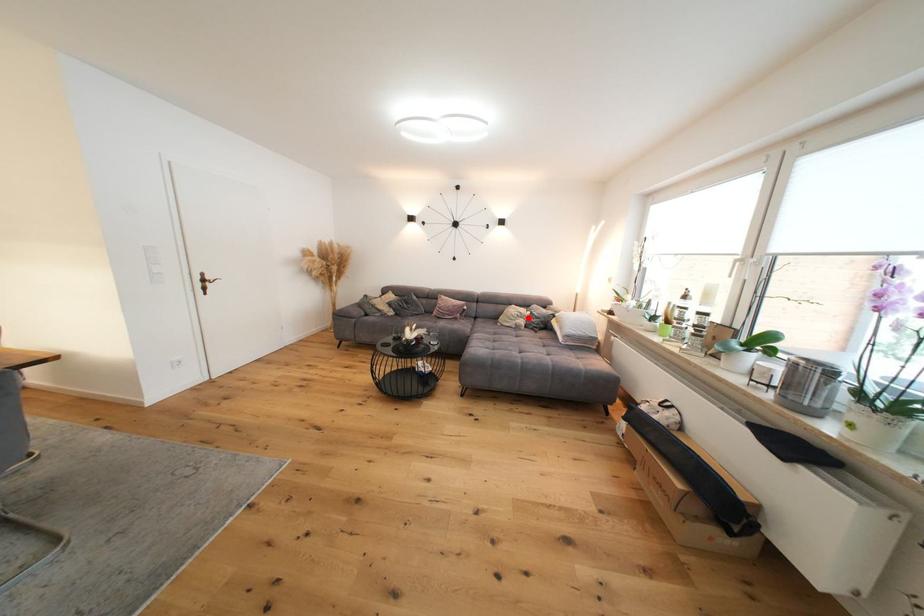
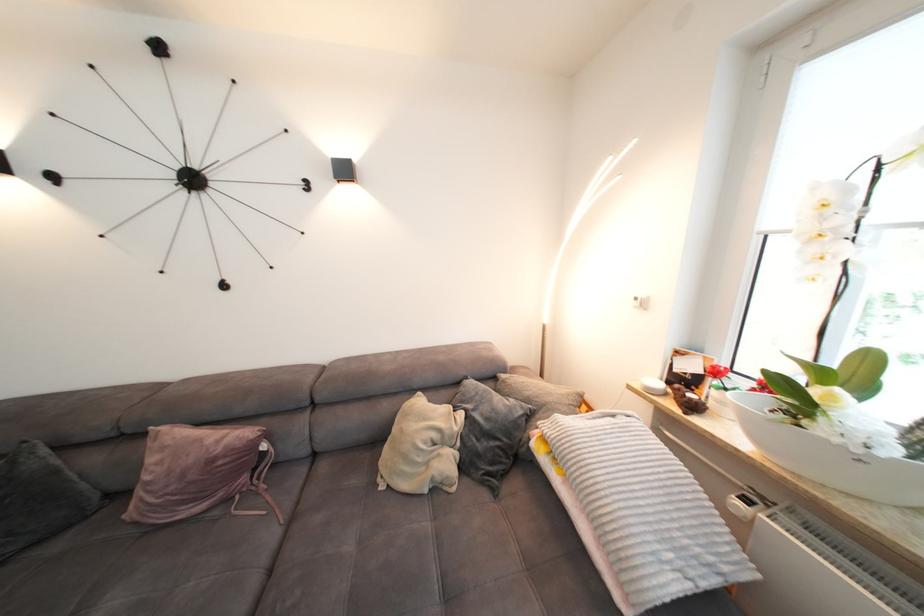
The point at the highlighted location is marked in the first image. Where is the corresponding point in the second image?

(450, 440)